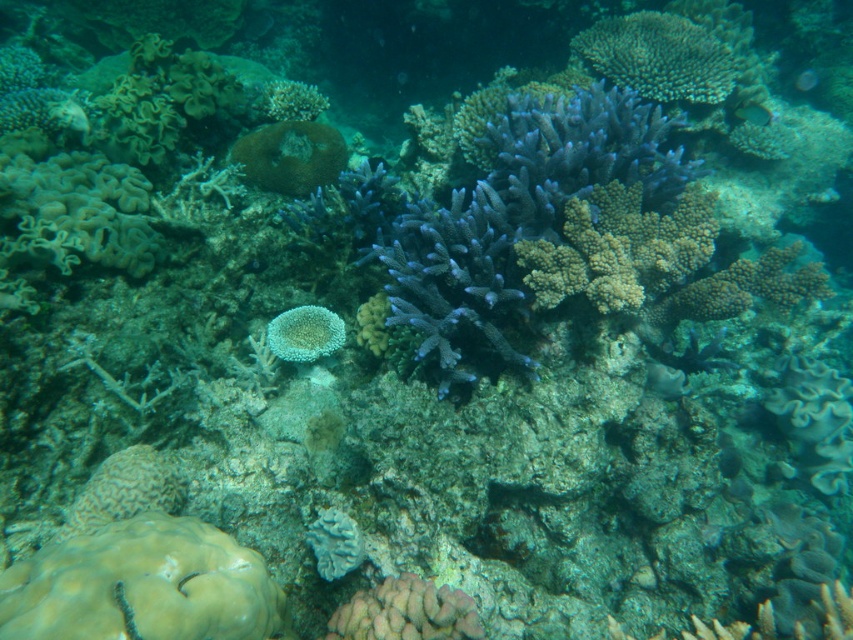
Is yellow matte coral at lower left to the right of white porous coral at lower center from the viewer's perspective?

No, yellow matte coral at lower left is not to the right of white porous coral at lower center.

Can you confirm if yellow matte coral at lower left is bigger than white porous coral at lower center?

Indeed, yellow matte coral at lower left has a larger size compared to white porous coral at lower center.

This screenshot has height=640, width=853. In order to click on yellow matte coral at lower left in this screenshot , I will do pos(143,586).

Can you confirm if yellow matte coral at lower left is bigger than smooth pink coral at center?

Indeed, yellow matte coral at lower left has a larger size compared to smooth pink coral at center.

Does yellow matte coral at lower left appear over smooth pink coral at center?

Yes, yellow matte coral at lower left is above smooth pink coral at center.

The width and height of the screenshot is (853, 640). Find the location of `yellow matte coral at lower left`. yellow matte coral at lower left is located at coordinates (143, 586).

Between rough textured coral at upper right and shiny blue fish at upper right, which one has less height?

Standing shorter between the two is shiny blue fish at upper right.

Consider the image. Can you confirm if rough textured coral at upper right is positioned to the left of shiny blue fish at upper right?

Yes, rough textured coral at upper right is to the left of shiny blue fish at upper right.

Identify the location of rough textured coral at upper right. (657, 56).

Identify the location of rough textured coral at upper right. (657, 56).